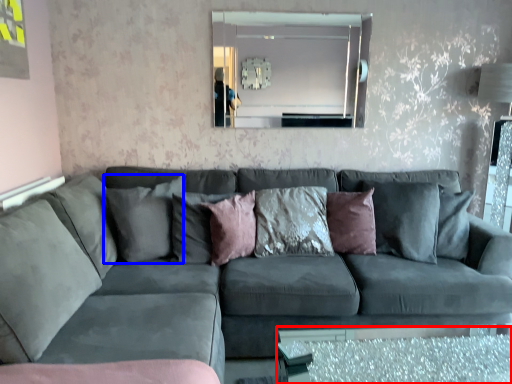
Question: Which of the following is the farthest to the observer, glass table (highlighted by a red box) or pillow (highlighted by a blue box)?

Choices:
 (A) glass table
 (B) pillow

Answer: (B)